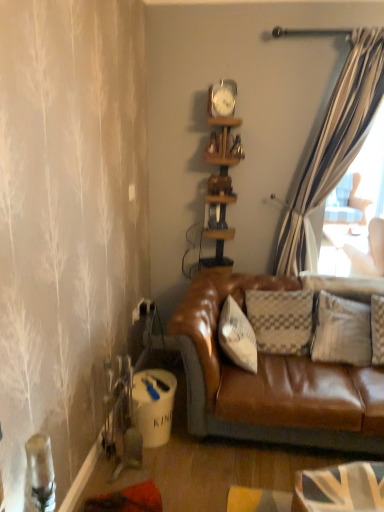
Where is `metallic silver clock at upper center`? This screenshot has height=512, width=384. metallic silver clock at upper center is located at coordinates (223, 98).

Identify the location of wooden clock at upper center, placed as the second shelf when sorted from bottom to top. (222, 153).

Between wooden shelf at center, which appears as the 2th shelf when viewed from the top, and wooden clock at upper center, which is counted as the first shelf, starting from the top, which one appears on the left side from the viewer's perspective?

From the viewer's perspective, wooden shelf at center, which appears as the 2th shelf when viewed from the top, appears more on the left side.

Considering the points (224, 124) and (224, 126), which point is in front, point (224, 124) or point (224, 126)?

The point (224, 124) is closer.

Consider the image. Between wooden shelf at center, the first shelf in the bottom-to-top sequence, and wooden clock at upper center, placed as the second shelf when sorted from bottom to top, which one has smaller width?

With smaller width is wooden clock at upper center, placed as the second shelf when sorted from bottom to top.

Is point (232, 159) closer or farther from the camera than point (218, 199)?

Point (232, 159) is positioned closer to the camera compared to point (218, 199).

Are wooden clock at upper center, placed as the second shelf when sorted from bottom to top, and wooden shelf at center, the first shelf in the bottom-to-top sequence, far apart?

No, wooden clock at upper center, placed as the second shelf when sorted from bottom to top, is not far away from wooden shelf at center, the first shelf in the bottom-to-top sequence.

This screenshot has width=384, height=512. Find the location of `shelf below the wooden clock at upper center, which is counted as the first shelf, starting from the top (from the image's perspective)`. shelf below the wooden clock at upper center, which is counted as the first shelf, starting from the top (from the image's perspective) is located at coordinates (219, 233).

Based on the photo, considering the sizes of objects wooden clock at upper center, placed as the second shelf when sorted from bottom to top, and wooden shelf at center, which appears as the 2th shelf when viewed from the top, in the image provided, who is smaller, wooden clock at upper center, placed as the second shelf when sorted from bottom to top, or wooden shelf at center, which appears as the 2th shelf when viewed from the top,?

With smaller size is wooden clock at upper center, placed as the second shelf when sorted from bottom to top.

From the image's perspective, is wooden shelf at center, the first shelf in the bottom-to-top sequence, below metallic silver clock at upper center?

Yes, from the image's perspective, wooden shelf at center, the first shelf in the bottom-to-top sequence, is beneath metallic silver clock at upper center.

Which object is further away from the camera taking this photo, wooden shelf at center, which appears as the 2th shelf when viewed from the top, or metallic silver clock at upper center?

wooden shelf at center, which appears as the 2th shelf when viewed from the top, is further away from the camera.

Locate an element on the screen. The height and width of the screenshot is (512, 384). clock that is in front of the wooden shelf at center, the first shelf in the bottom-to-top sequence is located at coordinates (223, 98).

Can you confirm if metallic silver clock at upper center is positioned to the left of wooden clock at upper center, which is counted as the first shelf, starting from the top?

Yes, metallic silver clock at upper center is to the left of wooden clock at upper center, which is counted as the first shelf, starting from the top.

From a real-world perspective, is metallic silver clock at upper center positioned above or below wooden clock at upper center, which is counted as the first shelf, starting from the top?

Clearly, from a real-world perspective, metallic silver clock at upper center is above wooden clock at upper center, which is counted as the first shelf, starting from the top.

Measure the distance from metallic silver clock at upper center to wooden clock at upper center, placed as the second shelf when sorted from bottom to top.

18.49 centimeters.

Is metallic silver clock at upper center facing towards wooden clock at upper center, which is counted as the first shelf, starting from the top?

No, metallic silver clock at upper center is not turned towards wooden clock at upper center, which is counted as the first shelf, starting from the top.

Considering the relative sizes of wooden clock at upper center, placed as the second shelf when sorted from bottom to top, and metallic silver clock at upper center in the image provided, is wooden clock at upper center, placed as the second shelf when sorted from bottom to top, smaller than metallic silver clock at upper center?

Incorrect, wooden clock at upper center, placed as the second shelf when sorted from bottom to top, is not smaller in size than metallic silver clock at upper center.

Would you say metallic silver clock at upper center is part of wooden clock at upper center, placed as the second shelf when sorted from bottom to top,'s contents?

No, metallic silver clock at upper center is not surrounded by wooden clock at upper center, placed as the second shelf when sorted from bottom to top.

From a real-world perspective, who is located lower, wooden clock at upper center, placed as the second shelf when sorted from bottom to top, or metallic silver clock at upper center?

In real-world perspective, wooden clock at upper center, placed as the second shelf when sorted from bottom to top, is lower.

Is wooden clock at upper center, which is counted as the first shelf, starting from the top, positioned far away from metallic silver clock at upper center?

No, wooden clock at upper center, which is counted as the first shelf, starting from the top, is not far away from metallic silver clock at upper center.

In terms of size, does metallic silver clock at upper center appear bigger or smaller than wooden shelf at center, which appears as the 2th shelf when viewed from the top?

In the image, metallic silver clock at upper center appears to be smaller than wooden shelf at center, which appears as the 2th shelf when viewed from the top.

Which of these two, metallic silver clock at upper center or wooden shelf at center, which appears as the 2th shelf when viewed from the top, stands taller?

With more height is wooden shelf at center, which appears as the 2th shelf when viewed from the top.

Is metallic silver clock at upper center thinner than wooden shelf at center, which appears as the 2th shelf when viewed from the top?

Yes, metallic silver clock at upper center is thinner than wooden shelf at center, which appears as the 2th shelf when viewed from the top.

The height and width of the screenshot is (512, 384). Find the location of `shelf above the wooden shelf at center, the first shelf in the bottom-to-top sequence (from a real-world perspective)`. shelf above the wooden shelf at center, the first shelf in the bottom-to-top sequence (from a real-world perspective) is located at coordinates (222, 153).

Where is `shelf on the right of wooden shelf at center, the first shelf in the bottom-to-top sequence`? This screenshot has height=512, width=384. shelf on the right of wooden shelf at center, the first shelf in the bottom-to-top sequence is located at coordinates (222, 153).

From the image, which object appears to be farther from wooden clock at upper center, which is counted as the first shelf, starting from the top, wooden shelf at center, which appears as the 2th shelf when viewed from the top, or metallic silver clock at upper center?

Among the two, wooden shelf at center, which appears as the 2th shelf when viewed from the top, is located further to wooden clock at upper center, which is counted as the first shelf, starting from the top.

Considering their positions, is wooden shelf at center, the first shelf in the bottom-to-top sequence, positioned closer to metallic silver clock at upper center than wooden clock at upper center, placed as the second shelf when sorted from bottom to top?

wooden clock at upper center, placed as the second shelf when sorted from bottom to top.

Looking at the image, which one is located further to metallic silver clock at upper center, wooden clock at upper center, which is counted as the first shelf, starting from the top, or wooden shelf at center, which appears as the 2th shelf when viewed from the top?

wooden shelf at center, which appears as the 2th shelf when viewed from the top.

Estimate the real-world distances between objects in this image. Which object is closer to wooden shelf at center, the first shelf in the bottom-to-top sequence, metallic silver clock at upper center or wooden clock at upper center, placed as the second shelf when sorted from bottom to top?

wooden clock at upper center, placed as the second shelf when sorted from bottom to top, is closer to wooden shelf at center, the first shelf in the bottom-to-top sequence.

From the image, which object appears to be farther from wooden shelf at center, the first shelf in the bottom-to-top sequence, wooden clock at upper center, placed as the second shelf when sorted from bottom to top, or metallic silver clock at upper center?

The object further to wooden shelf at center, the first shelf in the bottom-to-top sequence, is metallic silver clock at upper center.

From the picture: Estimate the real-world distances between objects in this image. Which object is closer to wooden clock at upper center, placed as the second shelf when sorted from bottom to top, metallic silver clock at upper center or wooden shelf at center, the first shelf in the bottom-to-top sequence?

metallic silver clock at upper center lies closer to wooden clock at upper center, placed as the second shelf when sorted from bottom to top, than the other object.

Find the location of a particular element. shelf between metallic silver clock at upper center and wooden shelf at center, the first shelf in the bottom-to-top sequence, from top to bottom is located at coordinates (222, 153).